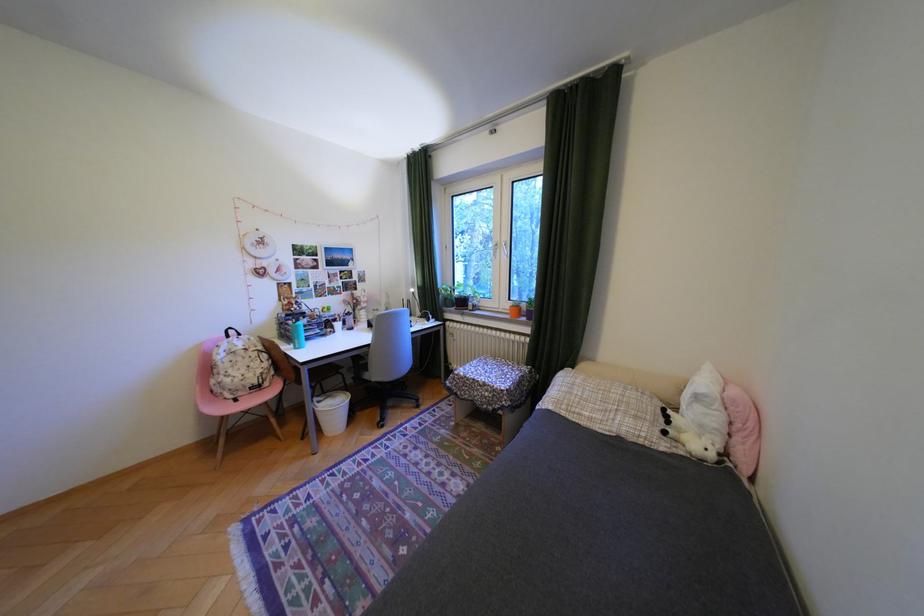
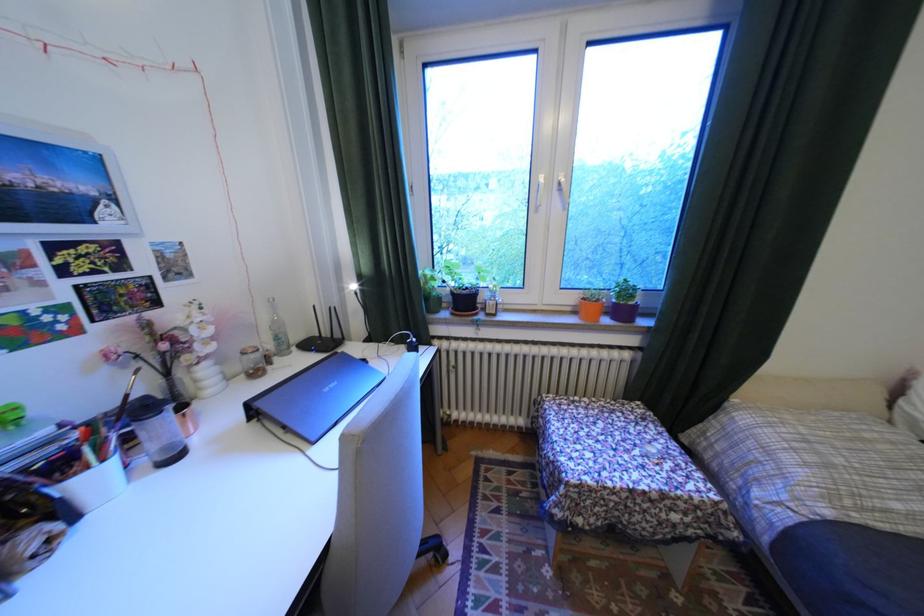
In the second image, find the point that corresponds to point (349, 325) in the first image.

(106, 479)